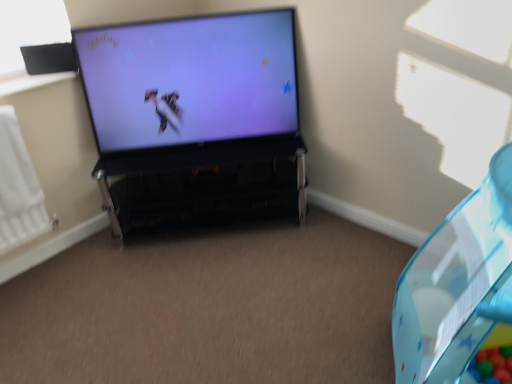
Question: Can you confirm if black glossy tv stand at center is taller than white matte radiator at left?

Choices:
 (A) yes
 (B) no

Answer: (B)

Question: Is black glossy tv stand at center positioned in front of white matte radiator at left?

Choices:
 (A) no
 (B) yes

Answer: (A)

Question: Is black glossy tv stand at center shorter than white matte radiator at left?

Choices:
 (A) yes
 (B) no

Answer: (A)

Question: Would you say black glossy tv stand at center is outside white matte radiator at left?

Choices:
 (A) no
 (B) yes

Answer: (B)

Question: Is black glossy tv stand at center smaller than white matte radiator at left?

Choices:
 (A) yes
 (B) no

Answer: (B)

Question: From the image's perspective, relative to white matte radiator at left, is black glossy tv stand at center above or below?

Choices:
 (A) above
 (B) below

Answer: (A)

Question: In terms of width, does black glossy tv stand at center look wider or thinner when compared to white matte radiator at left?

Choices:
 (A) wide
 (B) thin

Answer: (A)

Question: Visually, is black glossy tv stand at center positioned to the left or to the right of white matte radiator at left?

Choices:
 (A) right
 (B) left

Answer: (A)

Question: Considering the positions of black glossy tv stand at center and white matte radiator at left in the image, is black glossy tv stand at center bigger or smaller than white matte radiator at left?

Choices:
 (A) big
 (B) small

Answer: (A)

Question: Relative to matte black television at center, is white matte radiator at left in front or behind?

Choices:
 (A) behind
 (B) front

Answer: (B)

Question: Considering the positions of point (37, 198) and point (91, 92), is point (37, 198) closer or farther from the camera than point (91, 92)?

Choices:
 (A) farther
 (B) closer

Answer: (B)

Question: Which is correct: white matte radiator at left is inside matte black television at center, or outside of it?

Choices:
 (A) inside
 (B) outside

Answer: (B)

Question: From a real-world perspective, is white matte radiator at left above or below matte black television at center?

Choices:
 (A) below
 (B) above

Answer: (A)

Question: Do you think matte black television at center is within black glossy tv stand at center, or outside of it?

Choices:
 (A) inside
 (B) outside

Answer: (B)

Question: Considering the positions of matte black television at center and black glossy tv stand at center in the image, is matte black television at center taller or shorter than black glossy tv stand at center?

Choices:
 (A) tall
 (B) short

Answer: (A)